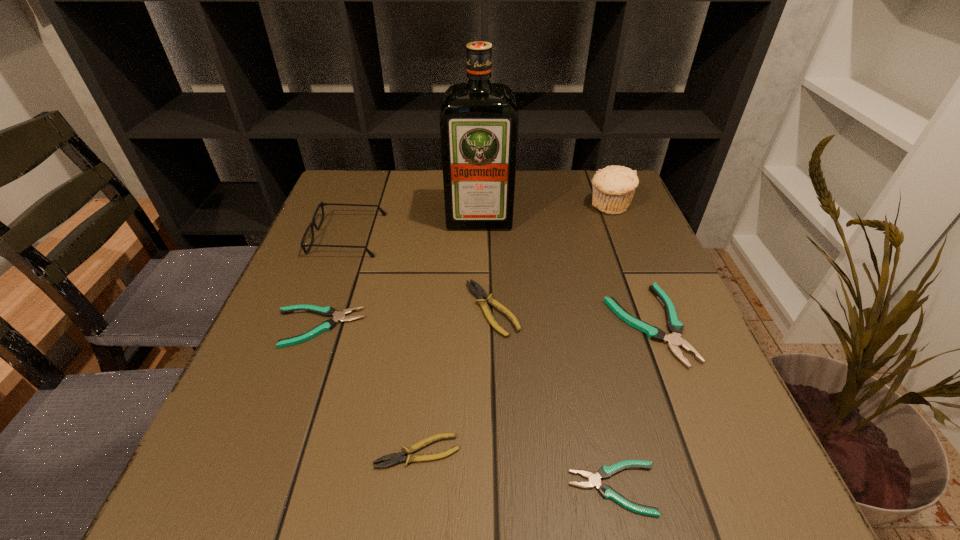
This screenshot has height=540, width=960. What are the coordinates of `the left yellow pliers` in the screenshot? It's located at (395, 458).

You are a GUI agent. You are given a task and a screenshot of the screen. Output one action in this format:
    pyautogui.click(x=<x>, y=<y>)
    Task: Click on the smaller yellow pliers
    The image size is (960, 540).
    Given the screenshot: What is the action you would take?
    pyautogui.click(x=395, y=458)

In order to click on the shortest object in this screenshot , I will do `click(594, 480)`.

This screenshot has height=540, width=960. Find the location of `the second teal pliers from right to left`. the second teal pliers from right to left is located at coordinates (594, 480).

The width and height of the screenshot is (960, 540). In order to click on free region located 0.400m on the front label of the tallest object in this screenshot , I will do `click(479, 366)`.

You are a GUI agent. You are given a task and a screenshot of the screen. Output one action in this format:
    pyautogui.click(x=<x>, y=<y>)
    Task: Click on the vacant point located on the left of the second tallest object
    This screenshot has width=960, height=540.
    Given the screenshot: What is the action you would take?
    pyautogui.click(x=435, y=206)

Identify the location of vacant space located on the left of the rightmost pliers. (516, 325).

Find the location of a particular element. This screenshot has height=540, width=960. vacant space located on the right of the bigger yellow pliers is located at coordinates (684, 309).

Find the location of a particular element. The width and height of the screenshot is (960, 540). vacant area located 0.090m on the right of the leftmost pliers is located at coordinates (409, 327).

This screenshot has height=540, width=960. Identify the location of vacant space located on the back of the fourth pliers from right to left. 424,390.